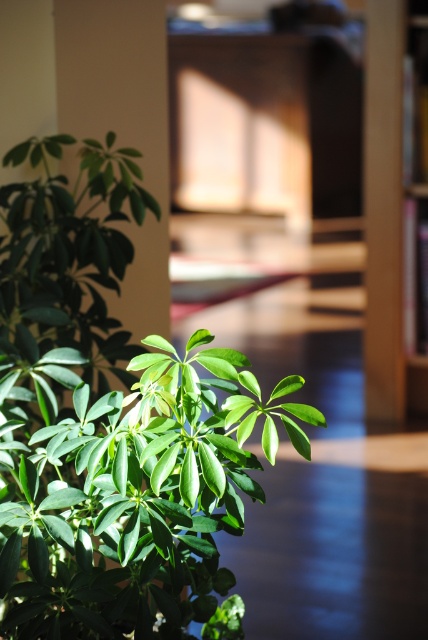
Can you confirm if green leafy plant at lower left is positioned to the right of brown wooden bookshelf at right?

In fact, green leafy plant at lower left is to the left of brown wooden bookshelf at right.

Who is more distant from viewer, (186, 380) or (398, 52)?

The point (398, 52) is behind.

Identify the location of green leafy plant at lower left. The image size is (428, 640). (127, 490).

Where is `green leafy plant at lower left`? The width and height of the screenshot is (428, 640). green leafy plant at lower left is located at coordinates (127, 490).